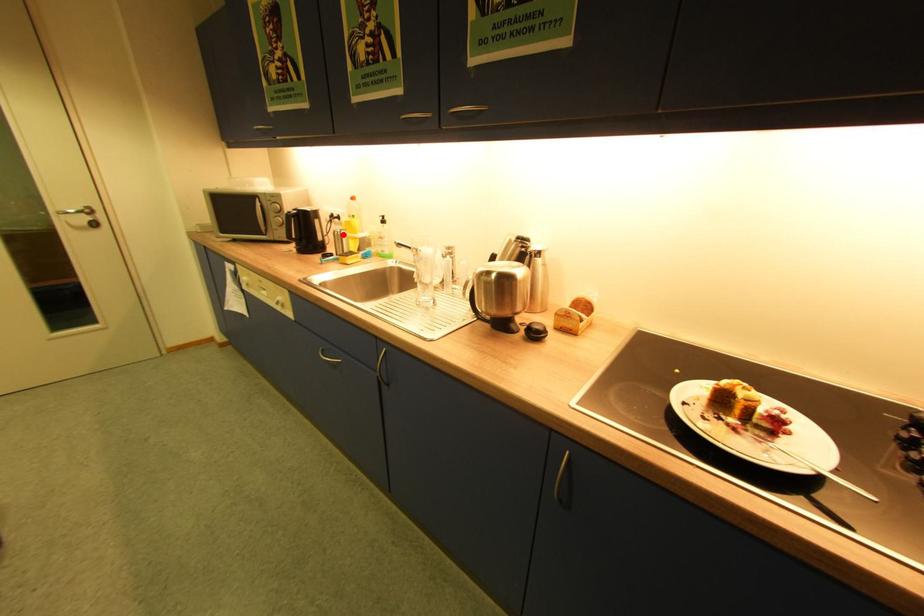
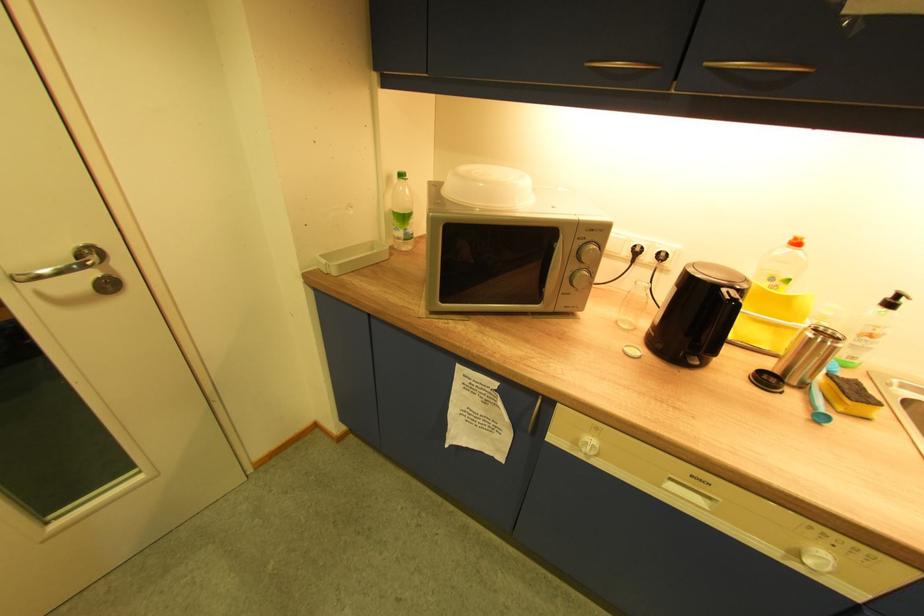
Question: I am providing you with two images of the same scene from different viewpoints. A red point is marked on the first image. At the location where the point appears in image 1, is it still visible in image 2?

Choices:
 (A) Yes
 (B) No

Answer: (A)